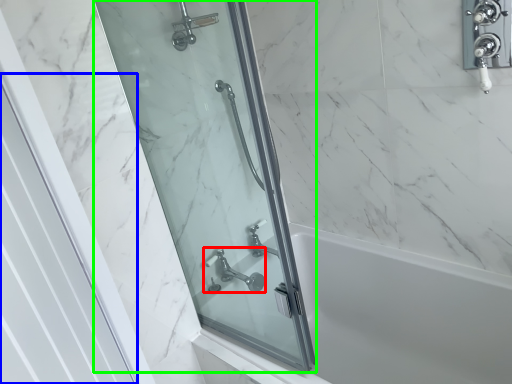
Question: Based on their relative distances, which object is farther from tap (highlighted by a red box)? Choose from screen door (highlighted by a blue box) and screen door (highlighted by a green box).

Choices:
 (A) screen door
 (B) screen door

Answer: (A)